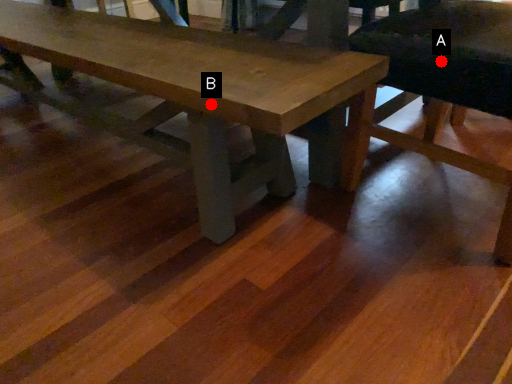
Question: Two points are circled on the image, labeled by A and B beside each circle. Among these points, which one is farthest from the camera?

Choices:
 (A) A is further
 (B) B is further

Answer: (A)